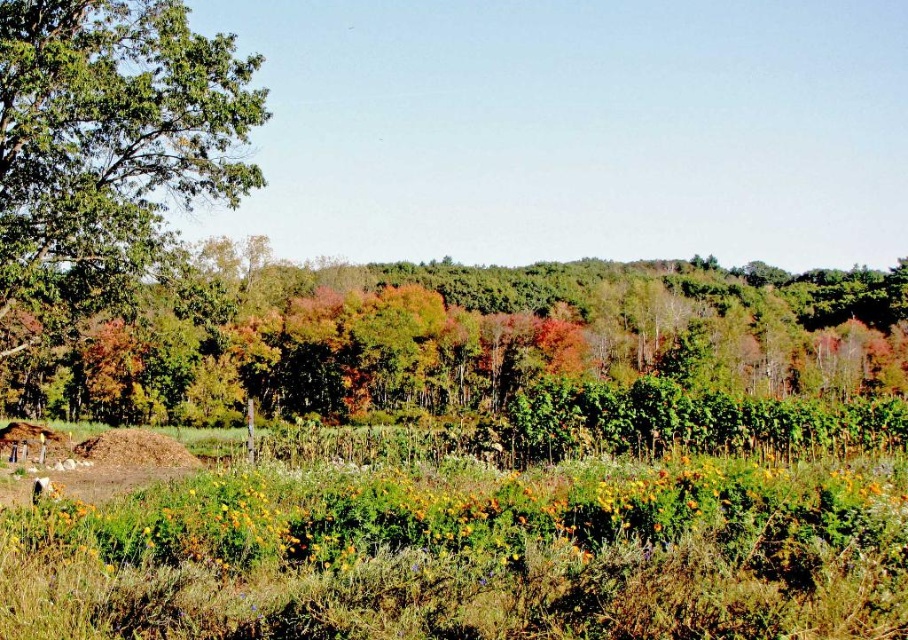
Question: Is green leafy tree at center to the left of green leafy tree at upper left from the viewer's perspective?

Choices:
 (A) yes
 (B) no

Answer: (B)

Question: Which is nearer to the green leafy tree at upper left?

Choices:
 (A) green grass at lower center
 (B) green leafy tree at center

Answer: (A)

Question: Which point is farther to the camera?

Choices:
 (A) green leafy tree at upper left
 (B) green leafy tree at center

Answer: (B)

Question: Which point appears closest to the camera in this image?

Choices:
 (A) (201, 136)
 (B) (284, 493)
 (C) (124, 422)

Answer: (B)

Question: Is green grass at lower center bigger than green leafy tree at upper left?

Choices:
 (A) yes
 (B) no

Answer: (B)

Question: Observing the image, what is the correct spatial positioning of green grass at lower center in reference to green leafy tree at center?

Choices:
 (A) left
 (B) right

Answer: (A)